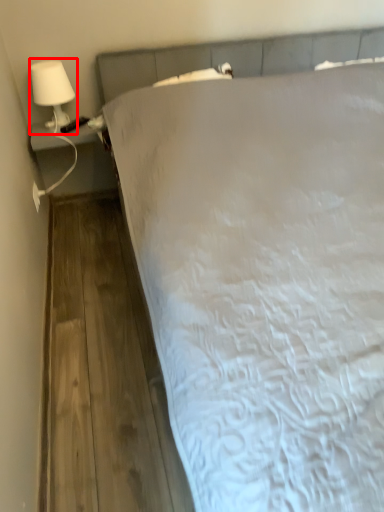
Question: From the image's perspective, what is the correct spatial positioning of lamp (annotated by the red box) in reference to bed?

Choices:
 (A) below
 (B) above

Answer: (B)